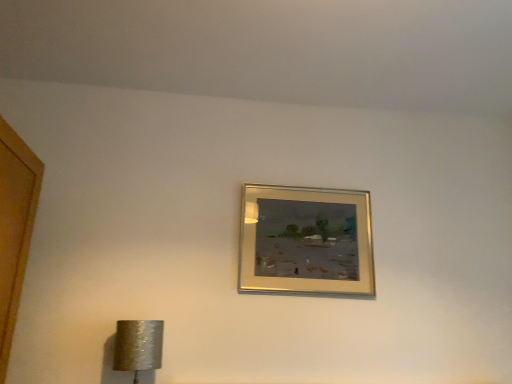
Question: Is gold metallic picture frame at upper center bigger or smaller than silver textured lampshade at lower left?

Choices:
 (A) small
 (B) big

Answer: (B)

Question: Is point (290, 231) positioned closer to the camera than point (129, 362)?

Choices:
 (A) farther
 (B) closer

Answer: (A)

Question: Considering their positions, is gold metallic picture frame at upper center located in front of or behind silver textured lampshade at lower left?

Choices:
 (A) behind
 (B) front

Answer: (A)

Question: Considering the positions of point (130, 329) and point (287, 188), is point (130, 329) closer or farther from the camera than point (287, 188)?

Choices:
 (A) farther
 (B) closer

Answer: (B)

Question: From the image's perspective, is silver textured lampshade at lower left above or below gold metallic picture frame at upper center?

Choices:
 (A) below
 (B) above

Answer: (A)

Question: Is silver textured lampshade at lower left to the left or to the right of gold metallic picture frame at upper center in the image?

Choices:
 (A) left
 (B) right

Answer: (A)

Question: From a real-world perspective, is silver textured lampshade at lower left positioned above or below gold metallic picture frame at upper center?

Choices:
 (A) below
 (B) above

Answer: (A)